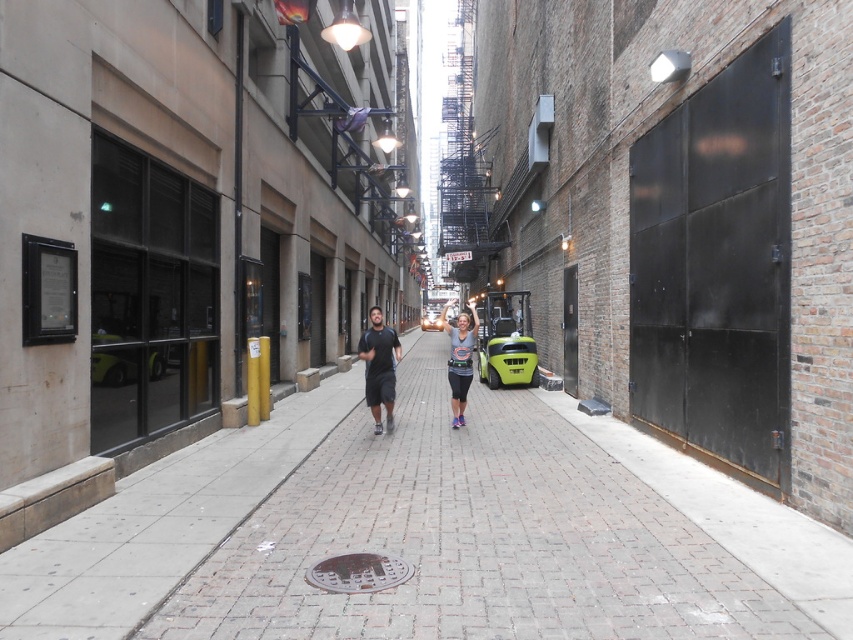
Question: Is brick pavement at center above shiny silver car at center?

Choices:
 (A) no
 (B) yes

Answer: (A)

Question: Which of the following is the farthest from the observer?

Choices:
 (A) dark gray fabric shirt at center
 (B) brick pavement at center
 (C) green matte forklift at center
 (D) gray cotton t-shirt at center

Answer: (D)

Question: Which of these objects is positioned closest to the dark gray fabric shirt at center?

Choices:
 (A) shiny silver car at center
 (B) green matte forklift at center
 (C) brick pavement at center

Answer: (C)

Question: Observing the image, what is the correct spatial positioning of dark gray fabric shirt at center in reference to gray cotton t-shirt at center?

Choices:
 (A) below
 (B) above

Answer: (A)

Question: Which point appears farthest from the camera in this image?

Choices:
 (A) (461, 404)
 (B) (440, 320)
 (C) (804, 611)
 (D) (372, 349)

Answer: (B)

Question: Is dark gray fabric shirt at center above gray cotton t-shirt at center?

Choices:
 (A) yes
 (B) no

Answer: (B)